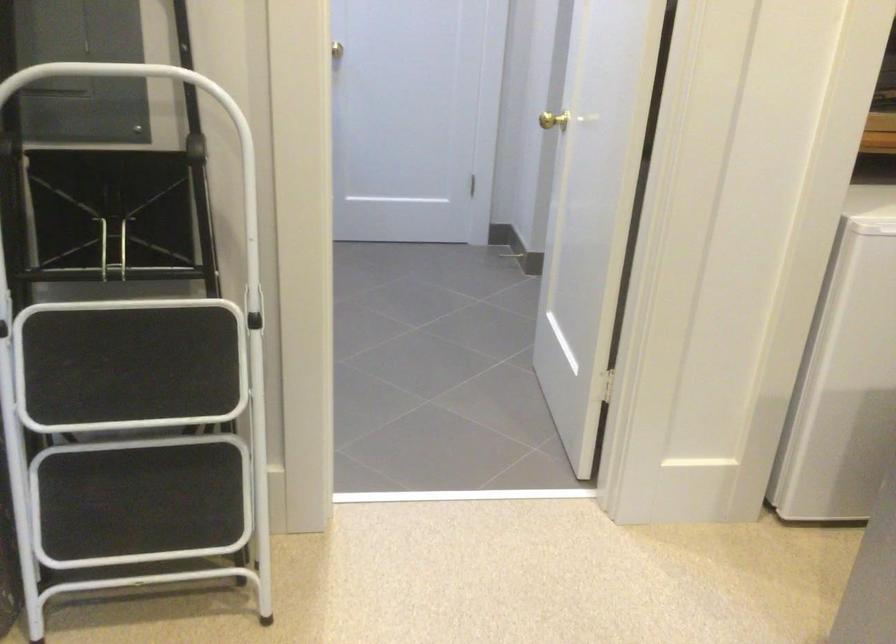
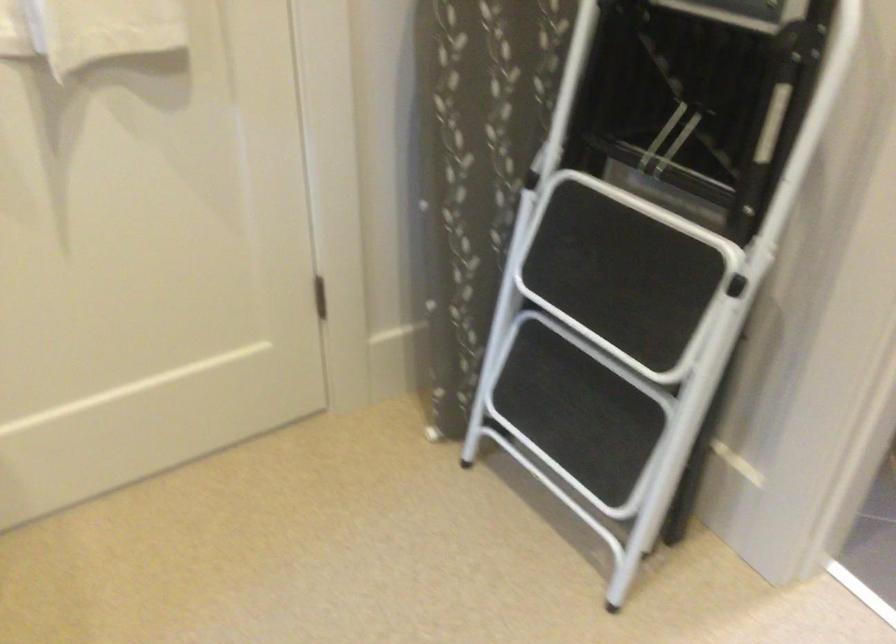
The point at (165, 426) is marked in the first image. Where is the corresponding point in the second image?

(607, 342)